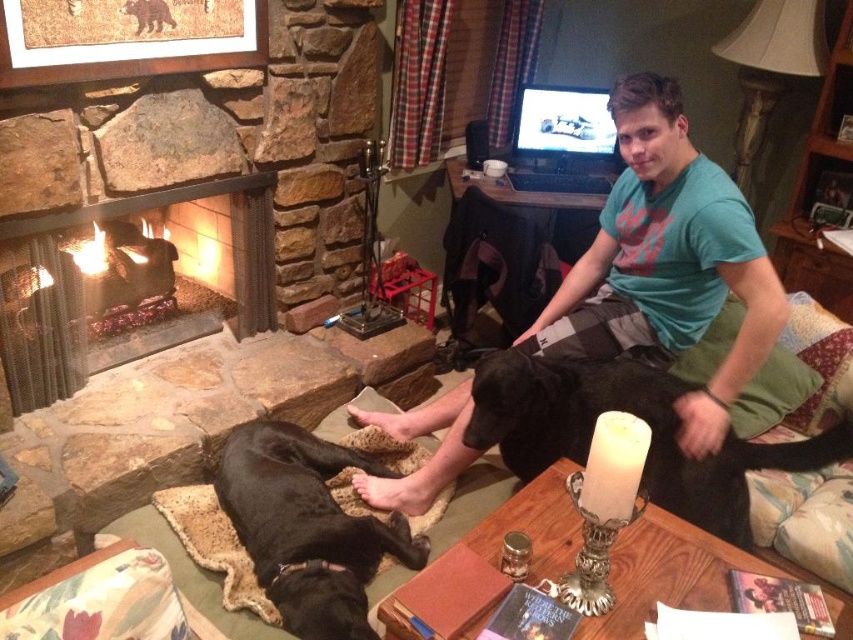
Consider the image. Between teal t-shirt at center and black fur dog at lower left, which one has more height?

teal t-shirt at center is taller.

Is teal t-shirt at center smaller than black fur dog at lower left?

No.

Who is more forward, (741, 276) or (289, 538)?

Point (289, 538) is more forward.

Locate an element on the screen. teal t-shirt at center is located at coordinates (666, 262).

Between point (511, 413) and point (224, 470), which one is positioned behind?

The point (224, 470) is behind.

Between point (567, 365) and point (262, 524), which one is positioned in front?

Point (262, 524)

Locate an element on the screen. black fur dog at lower center is located at coordinates (637, 417).

Between teal t-shirt at center and black fur dog at lower center, which one appears on the left side from the viewer's perspective?

Positioned to the left is black fur dog at lower center.

Is point (653, 99) closer to camera compared to point (546, 396)?

Yes, it is.

This screenshot has height=640, width=853. I want to click on teal t-shirt at center, so click(x=666, y=262).